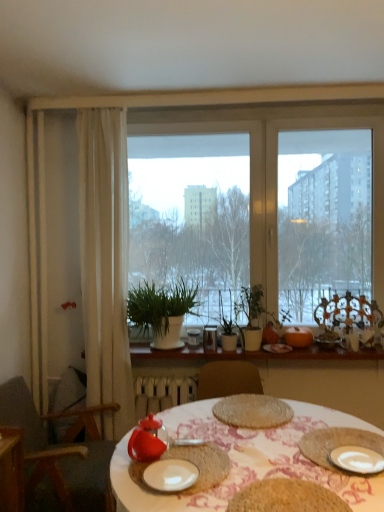
Locate an element on the screen. free spot behind white matte plate at center, which ranks as the 2th plate in right-to-left order is located at coordinates (192, 449).